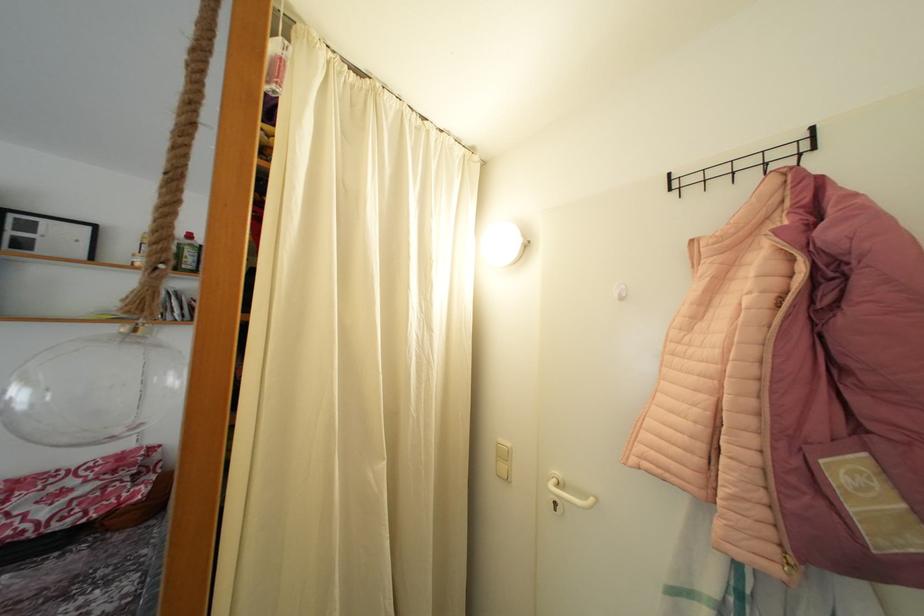
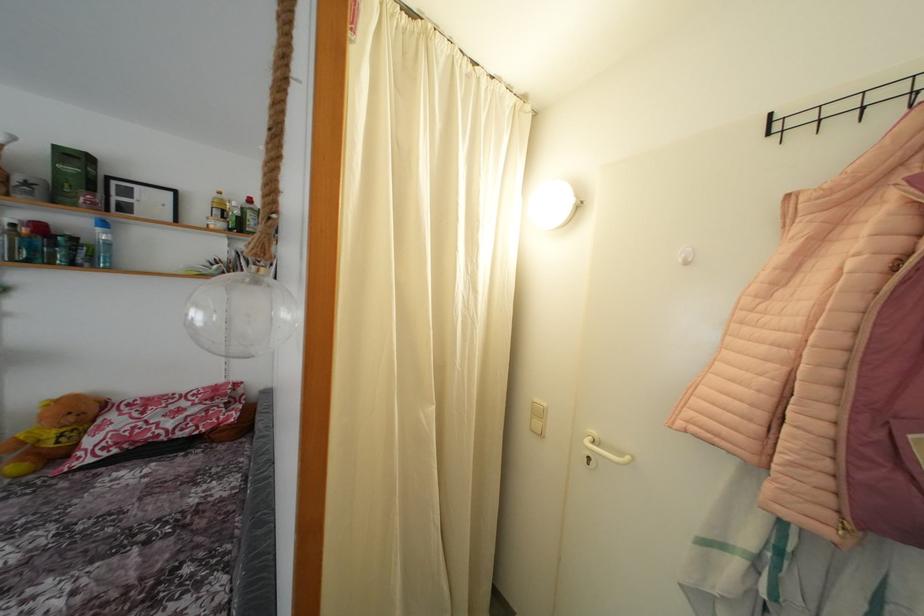
The point at (505,446) is marked in the first image. Where is the corresponding point in the second image?

(541, 406)